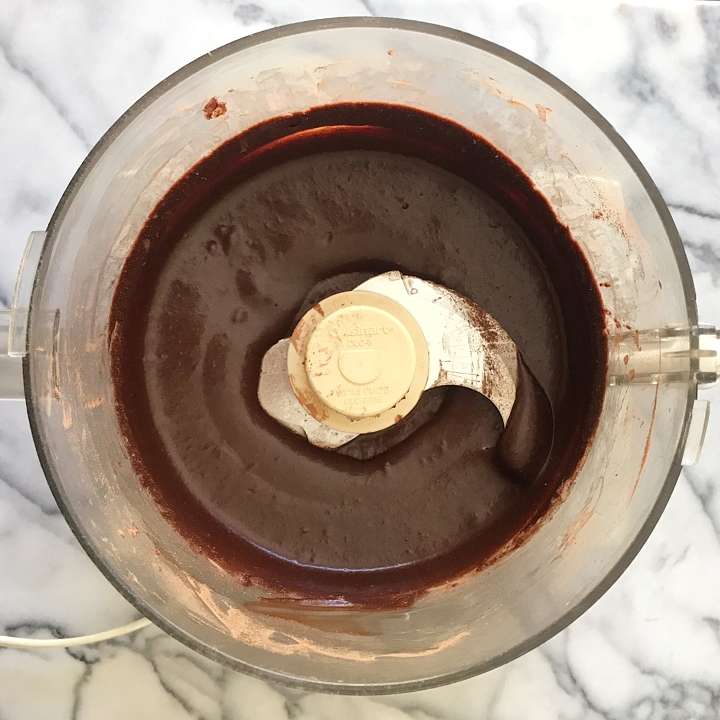
The image size is (720, 720). Find the location of `cable`. cable is located at coordinates (91, 643).